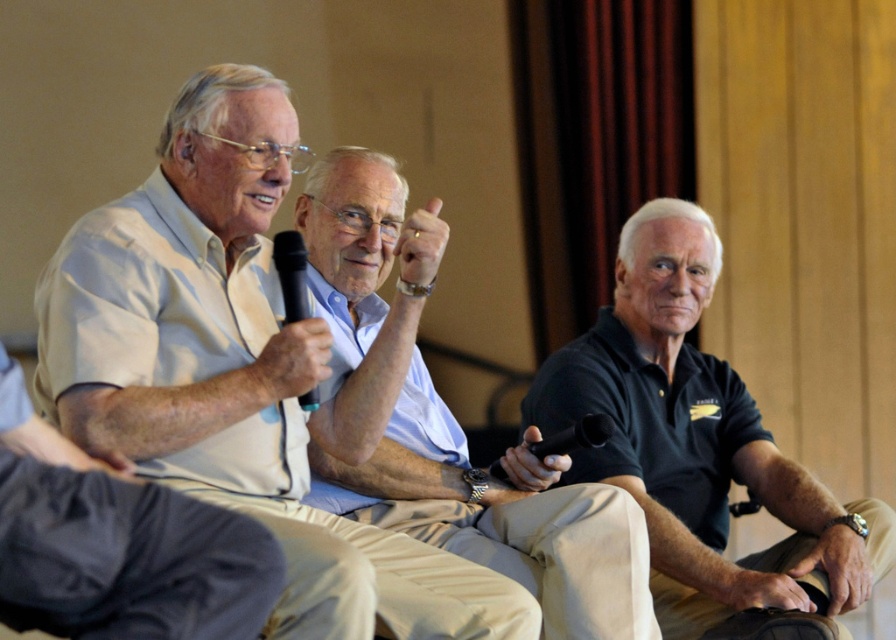
Is point (565, 358) positioned after point (808, 525)?

Yes.

Does black matte polo shirt at right have a smaller size compared to leather wristwatch at lower right?

No, black matte polo shirt at right is not smaller than leather wristwatch at lower right.

Identify the location of black matte polo shirt at right. The height and width of the screenshot is (640, 896). (685, 429).

Is matte black microphone at center above leather at center?

Correct, matte black microphone at center is located above leather at center.

Is matte black microphone at center bigger than leather at center?

Yes, matte black microphone at center is bigger than leather at center.

Find the location of `matte black microphone at center`. matte black microphone at center is located at coordinates (291, 360).

Can you confirm if light blue shirt at center is smaller than matte black microphone at center?

No, light blue shirt at center is not smaller than matte black microphone at center.

Can you confirm if light blue shirt at center is positioned above matte black microphone at center?

Incorrect, light blue shirt at center is not positioned above matte black microphone at center.

Who is more distant from viewer, (372, 257) or (266, 365)?

Point (372, 257)

The height and width of the screenshot is (640, 896). I want to click on light blue shirt at center, so click(x=498, y=520).